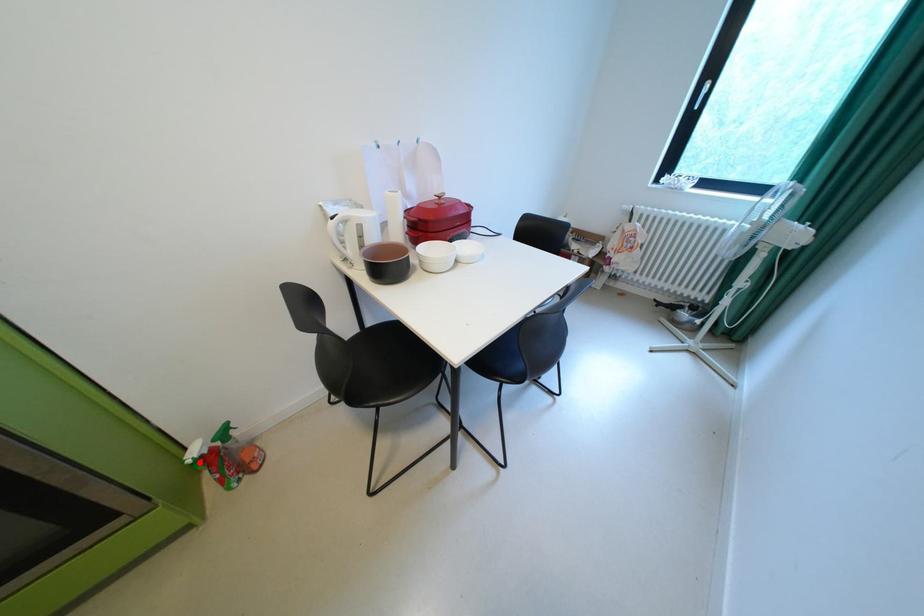
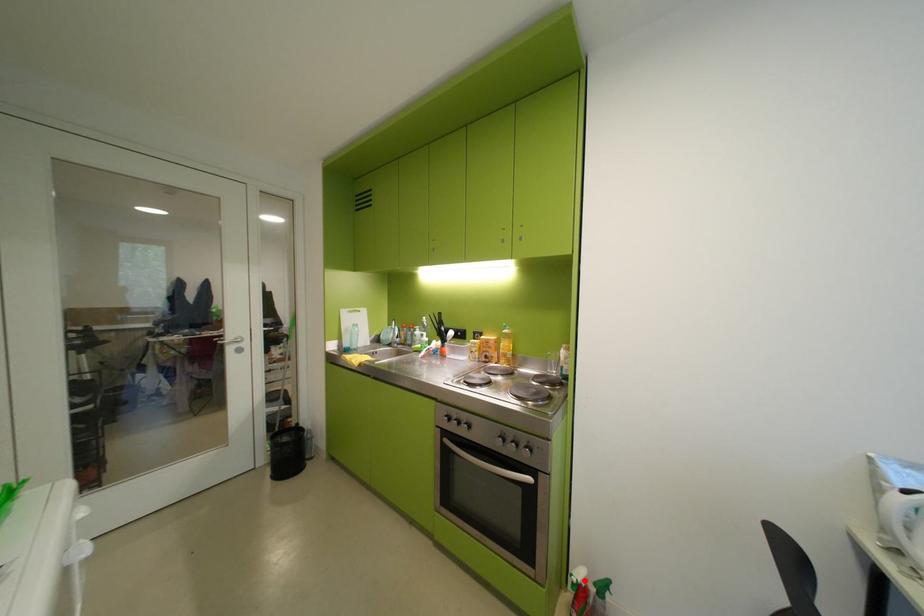
I am providing you with two images of the same scene from different viewpoints. A red point is marked on the first image and another point is marked on the second image. Is the marked point in image1 the same physical position as the marked point in image2?

Yes